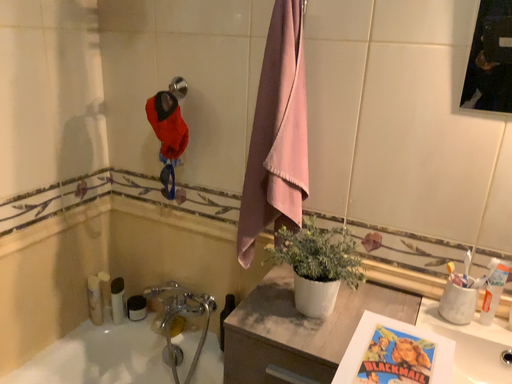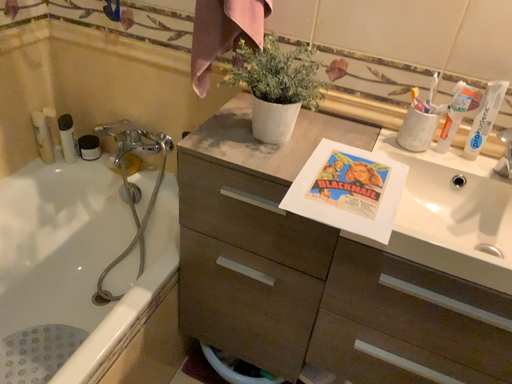
Question: How did the camera likely rotate when shooting the video?

Choices:
 (A) rotated downward
 (B) rotated upward

Answer: (A)